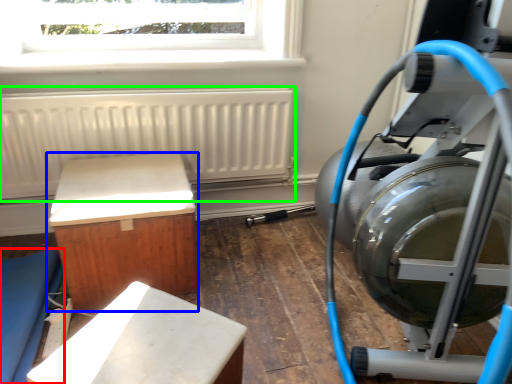
Question: Based on their relative distances, which object is nearer to furniture (highlighted by a red box)? Choose from furniture (highlighted by a blue box) and radiator (highlighted by a green box).

Choices:
 (A) furniture
 (B) radiator

Answer: (A)